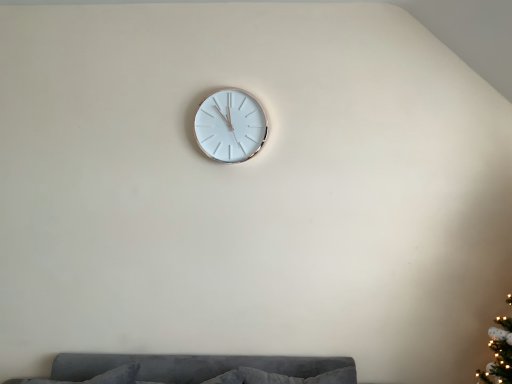
What do you see at coordinates (230, 126) in the screenshot? I see `white glossy clock at upper center` at bounding box center [230, 126].

At what (x,y) coordinates should I click in order to perform the action: click on white glossy clock at upper center. Please return your answer as a coordinate pair (x, y). Image resolution: width=512 pixels, height=384 pixels. Looking at the image, I should click on (230, 126).

This screenshot has height=384, width=512. In order to click on white glossy clock at upper center in this screenshot , I will do `click(230, 126)`.